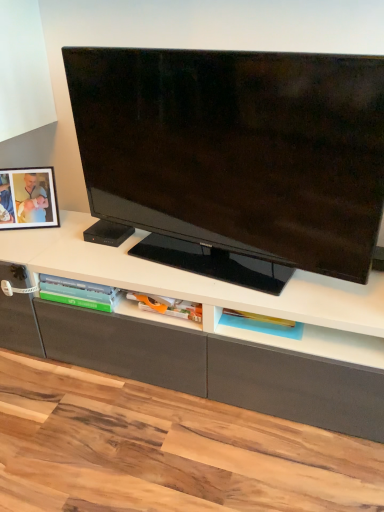
Question: Is matte black picture frame at left to the left or to the right of translucent plastic tray at lower center in the image?

Choices:
 (A) right
 (B) left

Answer: (B)

Question: From the image's perspective, is matte black picture frame at left located above or below translucent plastic tray at lower center?

Choices:
 (A) below
 (B) above

Answer: (B)

Question: Which object is positioned closest to the matte black tv at center?

Choices:
 (A) matte black picture frame at left
 (B) translucent plastic tray at lower center

Answer: (B)

Question: Which object is positioned farthest from the translucent plastic tray at lower center?

Choices:
 (A) matte black picture frame at left
 (B) matte black tv at center

Answer: (A)